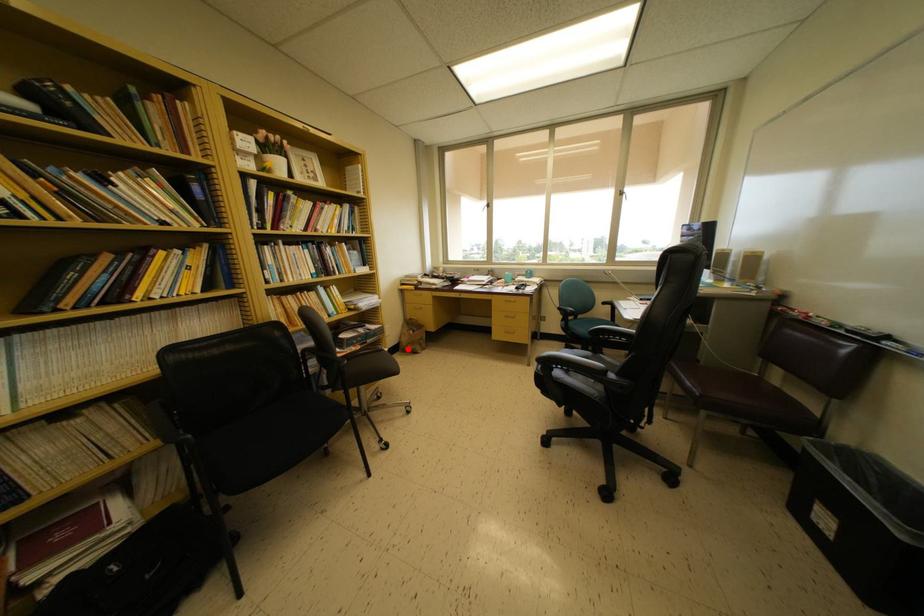
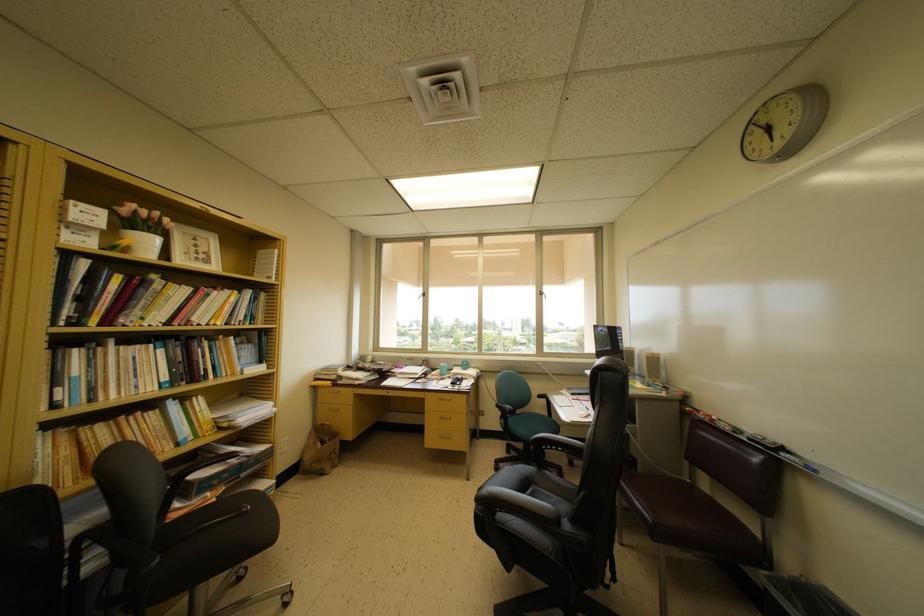
Find the pixel in the second image that matches the highlighted location in the first image.

(310, 468)